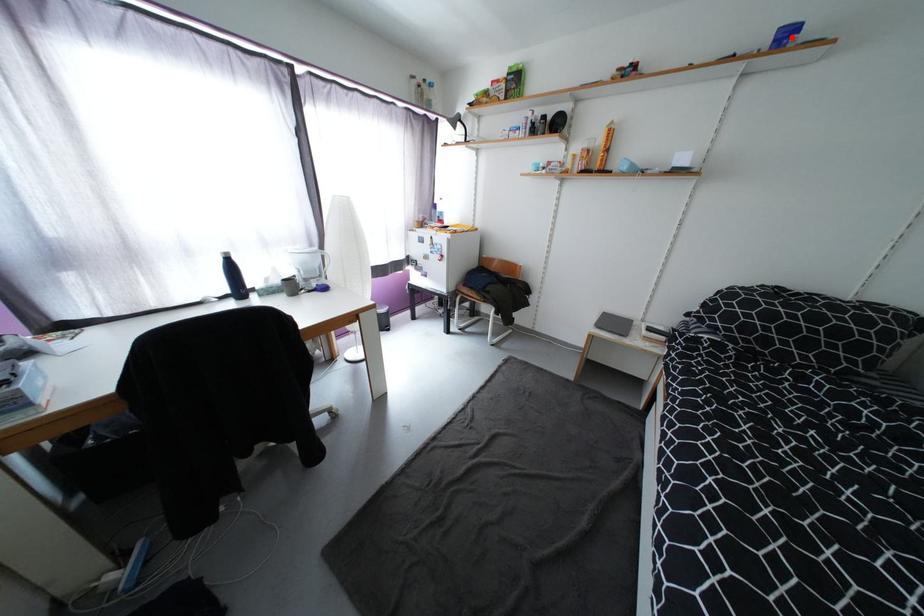
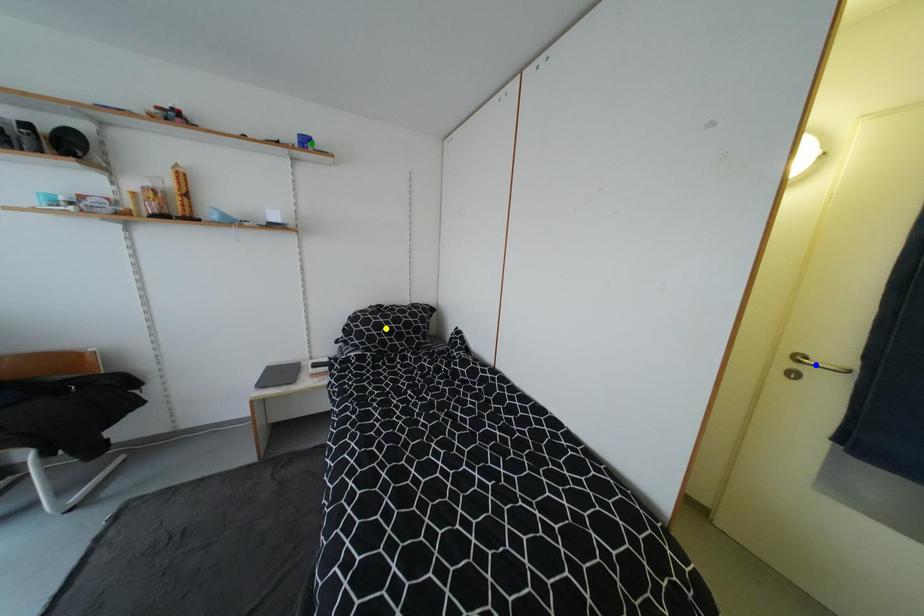
Question: I am providing you with two images of the same scene from different viewpoints. A red point is marked on the first image. You are given multiple points on the second image. Can you choose the point in image 2 that corresponds to the point in image 1?

Choices:
 (A) blue point
 (B) yellow point
 (C) green point

Answer: (C)